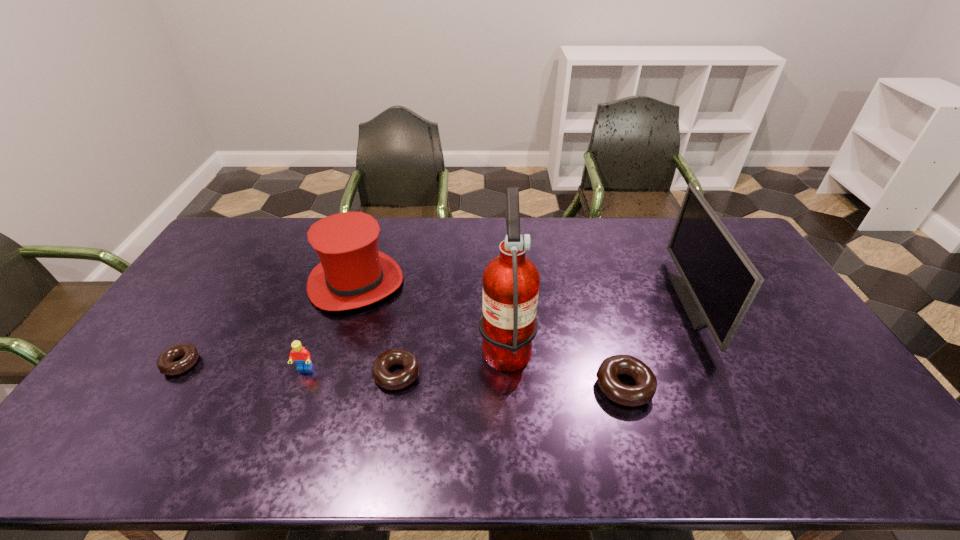
This screenshot has height=540, width=960. Find the location of `the closest doughnut relative to the rightmost doughnut`. the closest doughnut relative to the rightmost doughnut is located at coordinates (383, 377).

Locate which doughnut ranks third in proximity to the third tallest object. Please provide its 2D coordinates. Your answer should be formatted as a tuple, i.e. [(x, y)], where the tuple contains the x and y coordinates of a point satisfying the conditions above.

[(646, 383)]

I want to click on free spot that satisfies the following two spatial constraints: 1. on the screen side of the second tallest object; 2. on the face of the Lego, so click(731, 368).

Where is `vacant space that satisfies the following two spatial constraints: 1. on the nozzle and handle of the tallest object; 2. on the right side of the third shortest object`? vacant space that satisfies the following two spatial constraints: 1. on the nozzle and handle of the tallest object; 2. on the right side of the third shortest object is located at coordinates (509, 386).

The height and width of the screenshot is (540, 960). In order to click on free location that satisfies the following two spatial constraints: 1. on the nozzle and handle of the tallest object; 2. on the face of the Lego in this screenshot , I will do `click(508, 368)`.

You are a GUI agent. You are given a task and a screenshot of the screen. Output one action in this format:
    pyautogui.click(x=<x>, y=<y>)
    Task: Click on the free space in the image that satisfies the following two spatial constraints: 1. on the face of the fourth shortest object; 2. on the right side of the sixth tallest object
    The width and height of the screenshot is (960, 540).
    Given the screenshot: What is the action you would take?
    pyautogui.click(x=302, y=374)

Locate an element on the screen. This screenshot has width=960, height=540. vacant position in the image that satisfies the following two spatial constraints: 1. on the screen side of the sixth shortest object; 2. on the face of the fourth tallest object is located at coordinates (731, 368).